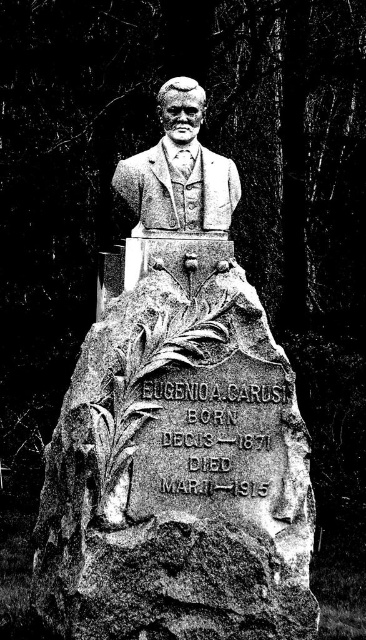
You are an archaeologist examining the tombstone monument. You need to determine which part of the monument is wider between the stone statue at center and the polished stone bust at center. Based on the scene, which one is wider?

The stone statue at center is wider than the polished stone bust at center according to the description.

You are a sculptor who needs to place a new decorative element between the stone statue at center and the polished stone bust at center. Given the space between them is 26.79 inches, can you fit a 24 inch wide decorative element there?

The distance between the stone statue at center and the polished stone bust at center is 26.79 inches. Since the decorative element is 24 inches wide, it can fit within the space as 24 is less than 26.79.